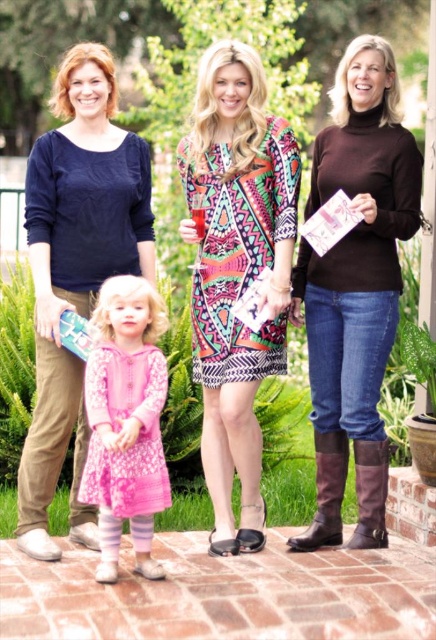
Question: Which object appears closest to the camera in this image?

Choices:
 (A) pink satin dress at lower left
 (B) brown leather boot at lower right

Answer: (A)

Question: Which point appears farthest from the camera in this image?

Choices:
 (A) (316, 436)
 (B) (348, 157)
 (C) (360, 513)
 (D) (106, 545)

Answer: (A)

Question: Is pink satin dress at lower left thinner than leather boots at lower right?

Choices:
 (A) yes
 (B) no

Answer: (B)

Question: Does printed fabric dress at center lie in front of leather boots at lower right?

Choices:
 (A) no
 (B) yes

Answer: (B)

Question: Considering the real-world distances, which object is closest to the pink satin dress at lower left?

Choices:
 (A) brown turtleneck sweater at center
 (B) brown leather boot at lower right
 (C) leather boots at lower right
 (D) printed fabric dress at center

Answer: (D)

Question: From the image, what is the correct spatial relationship of printed fabric dress at center in relation to matte navy blue blouse at left?

Choices:
 (A) right
 (B) left

Answer: (A)